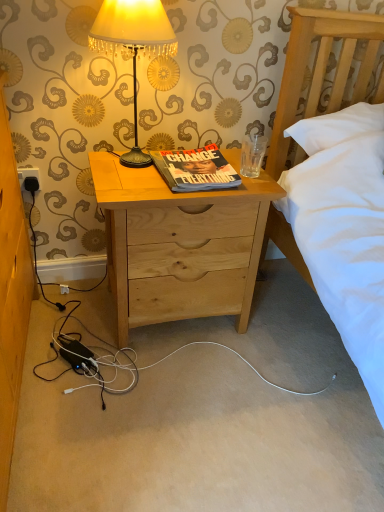
Question: Is natural wood nightstand at center positioned with its back to hardcover book at center?

Choices:
 (A) yes
 (B) no

Answer: (B)

Question: Can we say natural wood nightstand at center lies outside hardcover book at center?

Choices:
 (A) yes
 (B) no

Answer: (A)

Question: From the image's perspective, is natural wood nightstand at center located beneath hardcover book at center?

Choices:
 (A) no
 (B) yes

Answer: (B)

Question: Considering the relative positions of natural wood nightstand at center and hardcover book at center in the image provided, is natural wood nightstand at center to the right of hardcover book at center from the viewer's perspective?

Choices:
 (A) yes
 (B) no

Answer: (B)

Question: Is natural wood nightstand at center thinner than hardcover book at center?

Choices:
 (A) no
 (B) yes

Answer: (A)

Question: From the image's perspective, is black plastic power outlet at lower left above or below metallic lampshade at upper center?

Choices:
 (A) above
 (B) below

Answer: (B)

Question: In terms of height, does black plastic power outlet at lower left look taller or shorter compared to metallic lampshade at upper center?

Choices:
 (A) short
 (B) tall

Answer: (A)

Question: Do you think black plastic power outlet at lower left is within metallic lampshade at upper center, or outside of it?

Choices:
 (A) inside
 (B) outside

Answer: (B)

Question: From a real-world perspective, is black plastic power outlet at lower left above or below metallic lampshade at upper center?

Choices:
 (A) above
 (B) below

Answer: (B)

Question: Looking at their shapes, would you say black plastic power outlet at lower left is wider or thinner than hardcover book at center?

Choices:
 (A) thin
 (B) wide

Answer: (A)

Question: From the image's perspective, is black plastic power outlet at lower left positioned above or below hardcover book at center?

Choices:
 (A) above
 (B) below

Answer: (B)

Question: Considering their positions, is black plastic power outlet at lower left located in front of or behind hardcover book at center?

Choices:
 (A) front
 (B) behind

Answer: (B)

Question: From a real-world perspective, relative to hardcover book at center, is black plastic power outlet at lower left vertically above or below?

Choices:
 (A) above
 (B) below

Answer: (B)

Question: Is natural wood nightstand at center taller or shorter than metallic lampshade at upper center?

Choices:
 (A) tall
 (B) short

Answer: (A)

Question: In terms of width, does natural wood nightstand at center look wider or thinner when compared to metallic lampshade at upper center?

Choices:
 (A) wide
 (B) thin

Answer: (A)